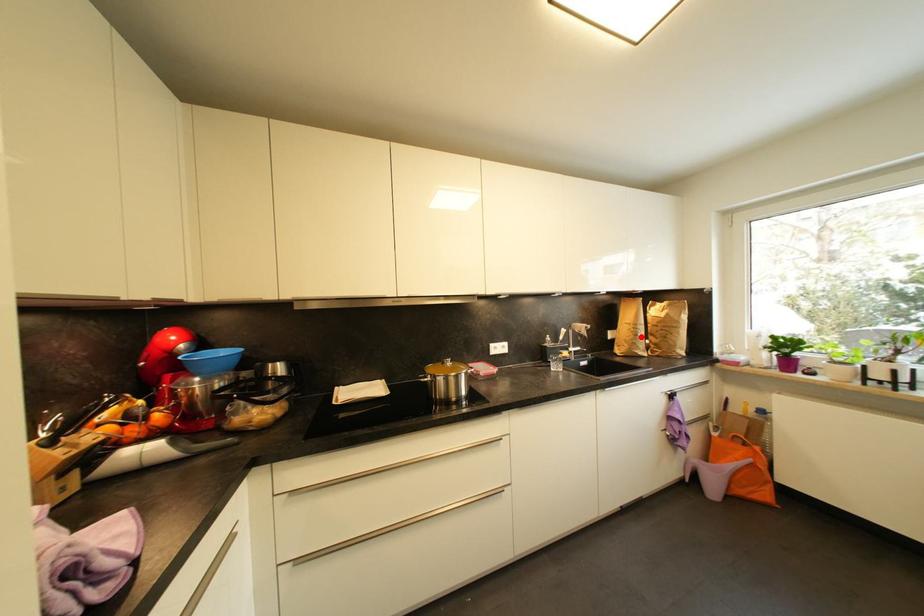
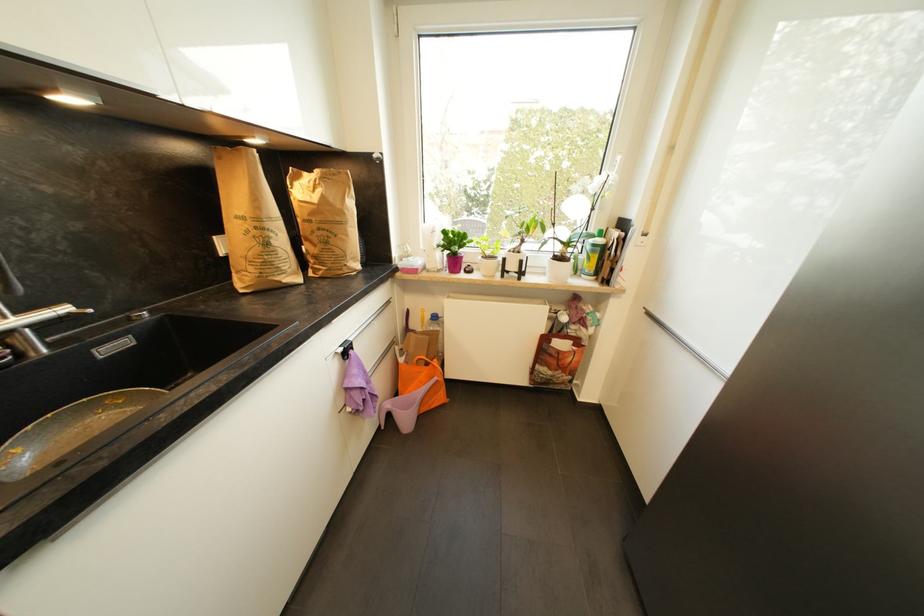
Question: A red point is marked in image1. In image2, is the corresponding 3D point closer to the camera or farther? Reply with the corresponding letter.

Choices:
 (A) The corresponding 3D point is closer.
 (B) The corresponding 3D point is farther.

Answer: (A)